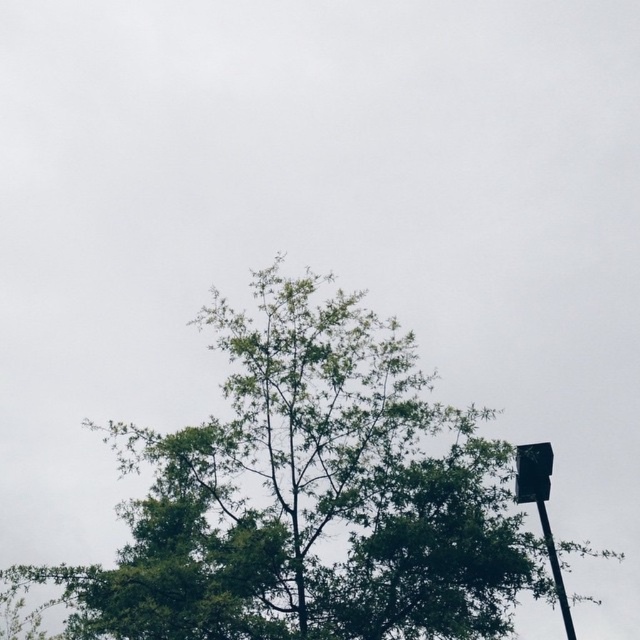
Can you confirm if metallic street sign at right is taller than metallic black traffic light at right?

Indeed, metallic street sign at right has a greater height compared to metallic black traffic light at right.

This screenshot has width=640, height=640. I want to click on metallic street sign at right, so click(541, 509).

Can you confirm if green leafy tree at upper center is positioned to the left of metallic black traffic light at right?

Correct, you'll find green leafy tree at upper center to the left of metallic black traffic light at right.

Where is `green leafy tree at upper center`? green leafy tree at upper center is located at coordinates (310, 497).

The height and width of the screenshot is (640, 640). In order to click on green leafy tree at upper center in this screenshot , I will do `click(310, 497)`.

Is metallic black traffic light at right below metallic pole at upper right?

No.

Can you confirm if metallic black traffic light at right is positioned above metallic pole at upper right?

Yes, metallic black traffic light at right is above metallic pole at upper right.

Looking at this image, who is more forward, (x=538, y=454) or (x=566, y=618)?

Point (x=538, y=454) is in front.

Identify the location of metallic black traffic light at right. (532, 472).